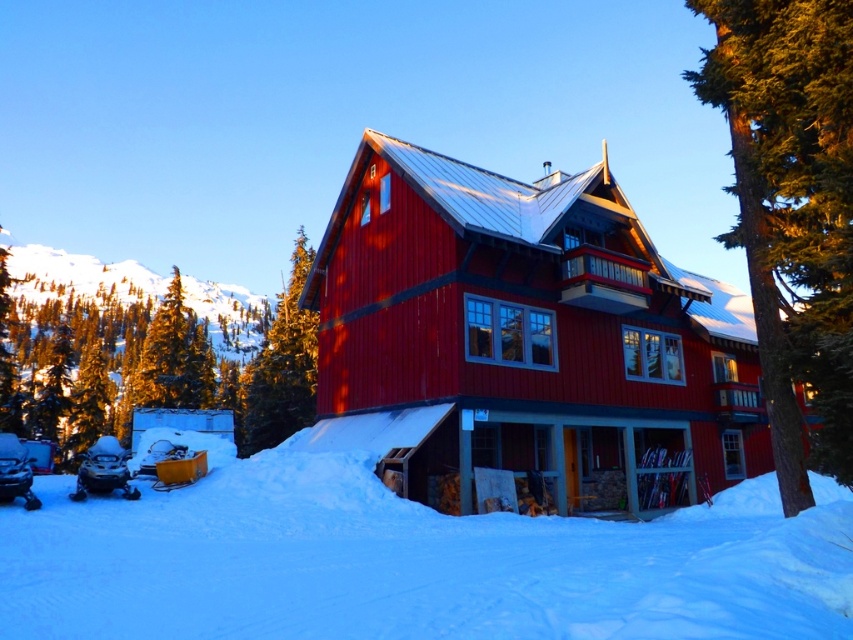
Locate an element on the screen. This screenshot has width=853, height=640. matte red cabin at center is located at coordinates (531, 330).

Does matte red cabin at center have a greater width compared to green textured tree at center?

No.

Image resolution: width=853 pixels, height=640 pixels. I want to click on matte red cabin at center, so click(531, 330).

This screenshot has width=853, height=640. In order to click on matte red cabin at center in this screenshot , I will do `click(531, 330)`.

Does matte red cabin at center lie in front of green textured pine tree at upper center?

Yes.

Does point (492, 464) lie in front of point (287, 291)?

Yes, point (492, 464) is closer to viewer.

Where is `matte red cabin at center`? This screenshot has width=853, height=640. matte red cabin at center is located at coordinates (531, 330).

Does green textured tree at center come behind green textured pine tree at upper center?

No.

Is green textured tree at center smaller than green textured pine tree at upper center?

No, green textured tree at center is not smaller than green textured pine tree at upper center.

Is point (756, 170) more distant than point (299, 257)?

No.

Locate an element on the screen. green textured tree at center is located at coordinates (792, 209).